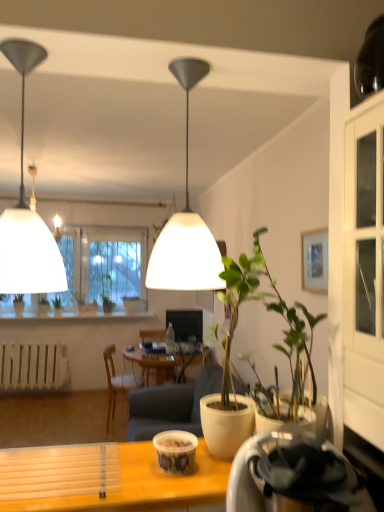
Locate an element on the screen. This screenshot has height=512, width=384. free region under matte white lampshade at upper left, which ranks as the second lamp in right-to-left order (from a real-world perspective) is located at coordinates (29, 466).